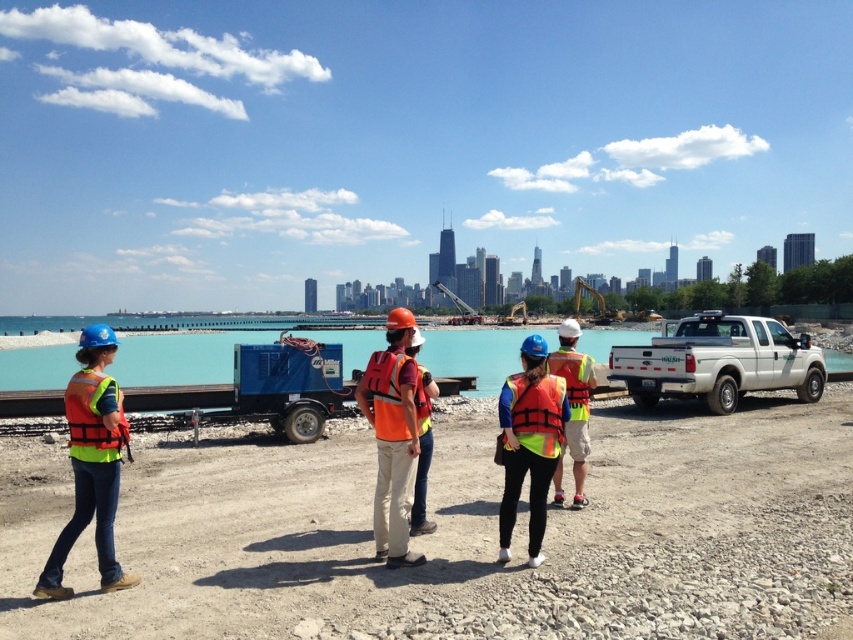
Can you confirm if neon yellow safety vest at center is shorter than orange reflective vest at center?

Indeed, neon yellow safety vest at center has a lesser height compared to orange reflective vest at center.

How much distance is there between neon yellow safety vest at center and orange reflective vest at center?

neon yellow safety vest at center is 4.06 meters away from orange reflective vest at center.

What do you see at coordinates (460, 534) in the screenshot? The height and width of the screenshot is (640, 853). I see `neon yellow safety vest at center` at bounding box center [460, 534].

This screenshot has width=853, height=640. Identify the location of neon yellow safety vest at center. (460, 534).

Who is positioned more to the left, neon yellow safety vest at center or high visibility fabric safety vest at left?

From the viewer's perspective, neon yellow safety vest at center appears more on the left side.

Can you confirm if neon yellow safety vest at center is wider than high visibility fabric safety vest at left?

Correct, the width of neon yellow safety vest at center exceeds that of high visibility fabric safety vest at left.

Who is more forward, (647, 556) or (94, 378)?

Positioned in front is point (94, 378).

I want to click on neon yellow safety vest at center, so click(x=460, y=534).

Is point (384, 387) less distant than point (584, 410)?

Yes, point (384, 387) is closer to viewer.

This screenshot has width=853, height=640. What do you see at coordinates (392, 436) in the screenshot?
I see `orange reflective vest at center` at bounding box center [392, 436].

The height and width of the screenshot is (640, 853). What do you see at coordinates (392, 436) in the screenshot? I see `orange reflective vest at center` at bounding box center [392, 436].

The width and height of the screenshot is (853, 640). Identify the location of orange reflective vest at center. (392, 436).